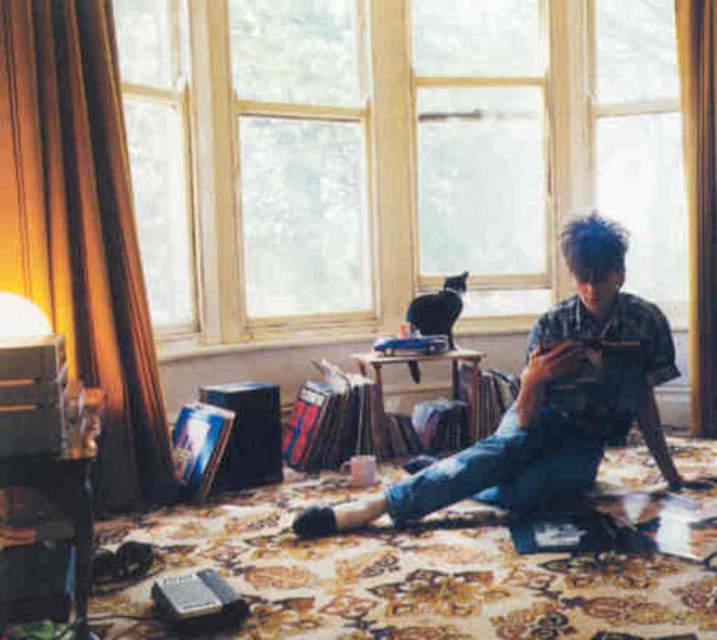
Question: Is denim shirt at center smaller than black fur cat at center?

Choices:
 (A) no
 (B) yes

Answer: (A)

Question: Which point is farther to the camera?

Choices:
 (A) (669, 122)
 (B) (441, 289)
 (C) (518, 394)

Answer: (A)

Question: Which of the following is the closest to the observer?

Choices:
 (A) black fur cat at center
 (B) denim shirt at center

Answer: (B)

Question: Which of these objects is positioned farthest from the denim shirt at center?

Choices:
 (A) black fur cat at center
 (B) wooden frame at upper center

Answer: (B)

Question: Observing the image, what is the correct spatial positioning of denim shirt at center in reference to black fur cat at center?

Choices:
 (A) left
 (B) right

Answer: (B)

Question: Is wooden frame at upper center smaller than black fur cat at center?

Choices:
 (A) yes
 (B) no

Answer: (B)